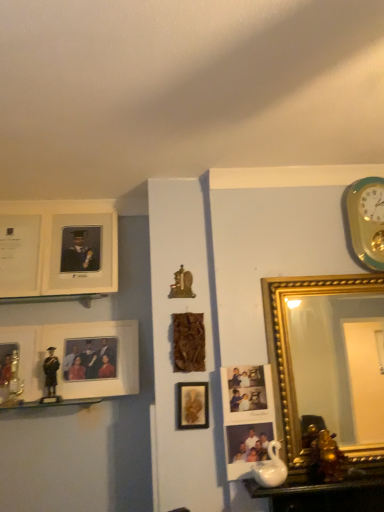
What do you see at coordinates (323, 495) in the screenshot? This screenshot has width=384, height=512. I see `white glossy table at lower right` at bounding box center [323, 495].

Measure the distance between point (3, 387) and camera.

A distance of 6.15 feet exists between point (3, 387) and camera.

In order to click on white glossy table at lower right in this screenshot , I will do pos(323,495).

From the image's perspective, between matte plastic photo frame at center, which is the eighth picture frame in left-to-right order, and wooden plaque at center, which is the fourth picture frame in right-to-left order, which one is located above?

wooden plaque at center, which is the fourth picture frame in right-to-left order, appears higher in the image.

Does point (250, 389) appear closer or farther from the camera than point (197, 337)?

Clearly, point (250, 389) is closer to the camera than point (197, 337).

In the scene shown: Is the depth of matte plastic photo frame at center, arranged as the 2th picture frame when viewed from the right, less than that of wooden plaque at center, which is the fourth picture frame in right-to-left order?

Yes, it is in front of wooden plaque at center, which is the fourth picture frame in right-to-left order.

Identify the location of picture frame that is the 2nd object to the right of the wooden plaque at center, which is the sixth picture frame in left-to-right order, starting at the anchor. This screenshot has height=512, width=384. (247, 417).

Is matte plastic photo frame at center, which is the eighth picture frame in left-to-right order, positioned far away from matte gold picture frame at center, placed as the seventh picture frame when sorted from left to right?

No, there isn't a large distance between matte plastic photo frame at center, which is the eighth picture frame in left-to-right order, and matte gold picture frame at center, placed as the seventh picture frame when sorted from left to right.

Does matte plastic photo frame at center, arranged as the 2th picture frame when viewed from the right, appear on the left side of matte gold picture frame at center, which appears as the 3th picture frame when viewed from the right?

No, matte plastic photo frame at center, arranged as the 2th picture frame when viewed from the right, is not to the left of matte gold picture frame at center, which appears as the 3th picture frame when viewed from the right.

Is matte plastic photo frame at center, arranged as the 2th picture frame when viewed from the right, oriented away from matte gold picture frame at center, which appears as the 3th picture frame when viewed from the right?

That's not correct — matte plastic photo frame at center, arranged as the 2th picture frame when viewed from the right, is not looking away from matte gold picture frame at center, which appears as the 3th picture frame when viewed from the right.

Measure the distance from matte plastic photo frame at center, arranged as the 2th picture frame when viewed from the right, to matte gold picture frame at center, which appears as the 3th picture frame when viewed from the right.

A distance of 6.56 inches exists between matte plastic photo frame at center, arranged as the 2th picture frame when viewed from the right, and matte gold picture frame at center, which appears as the 3th picture frame when viewed from the right.

Is matte plastic photo frame at center, which is the eighth picture frame in left-to-right order, facing away from matte white picture frame at upper left, the 6th picture frame in the right-to-left sequence?

No, matte plastic photo frame at center, which is the eighth picture frame in left-to-right order, is not facing away from matte white picture frame at upper left, the 6th picture frame in the right-to-left sequence.

Which point is more forward, [273,412] or [31,240]?

The point [273,412] is in front.

Looking at this image, considering the sizes of objects matte plastic photo frame at center, arranged as the 2th picture frame when viewed from the right, and matte white picture frame at upper left, which is the fourth picture frame in left-to-right order, in the image provided, who is thinner, matte plastic photo frame at center, arranged as the 2th picture frame when viewed from the right, or matte white picture frame at upper left, which is the fourth picture frame in left-to-right order,?

Thinner between the two is matte plastic photo frame at center, arranged as the 2th picture frame when viewed from the right.

Is matte plastic photo frame at center, which is the eighth picture frame in left-to-right order, in contact with matte white picture frame at upper left, the 6th picture frame in the right-to-left sequence?

No.

Who is taller, matte plastic photo frame at center, which is the eighth picture frame in left-to-right order, or gold/gilded mirror at right, the ninth picture frame positioned from the left?

gold/gilded mirror at right, the ninth picture frame positioned from the left.

Looking at this image, from the image's perspective, relative to gold/gilded mirror at right, the first picture frame in the right-to-left sequence, is matte plastic photo frame at center, arranged as the 2th picture frame when viewed from the right, above or below?

matte plastic photo frame at center, arranged as the 2th picture frame when viewed from the right, is below gold/gilded mirror at right, the first picture frame in the right-to-left sequence.

Who is smaller, matte plastic photo frame at center, arranged as the 2th picture frame when viewed from the right, or gold/gilded mirror at right, the ninth picture frame positioned from the left?

matte plastic photo frame at center, arranged as the 2th picture frame when viewed from the right, is smaller.

Considering the sizes of objects white glossy table at lower right and matte white picture frame at left, which ranks as the 5th picture frame in left-to-right order, in the image provided, who is smaller, white glossy table at lower right or matte white picture frame at left, which ranks as the 5th picture frame in left-to-right order,?

A: With smaller size is white glossy table at lower right.

Is white glossy table at lower right turned away from matte white picture frame at left, which ranks as the 5th picture frame in left-to-right order?

That's not correct — white glossy table at lower right is not looking away from matte white picture frame at left, which ranks as the 5th picture frame in left-to-right order.

From the image's perspective, is white glossy table at lower right above matte white picture frame at left, the 5th picture frame from the right?

Incorrect, from the image's perspective, white glossy table at lower right is lower than matte white picture frame at left, the 5th picture frame from the right.

Is white glossy table at lower right placed right next to matte white picture frame at left, which ranks as the 5th picture frame in left-to-right order?

No, white glossy table at lower right is not next to matte white picture frame at left, which ranks as the 5th picture frame in left-to-right order.

Considering the sizes of white glossy table at lower right and matte gold picture frame at center, placed as the seventh picture frame when sorted from left to right, in the image, is white glossy table at lower right wider or thinner than matte gold picture frame at center, placed as the seventh picture frame when sorted from left to right,?

Considering their sizes, white glossy table at lower right looks broader than matte gold picture frame at center, placed as the seventh picture frame when sorted from left to right.

How many degrees apart are the facing directions of white glossy table at lower right and matte gold picture frame at center, placed as the seventh picture frame when sorted from left to right?

The angle between the facing direction of white glossy table at lower right and the facing direction of matte gold picture frame at center, placed as the seventh picture frame when sorted from left to right, is 4.64 degrees.

Could you tell me if white glossy table at lower right is turned towards matte gold picture frame at center, placed as the seventh picture frame when sorted from left to right?

No.

Considering the positions of points (277, 508) and (207, 409), is point (277, 508) closer to camera compared to point (207, 409)?

That is True.

Considering their positions, is metallic gold picture frame at left, the second picture frame when ordered from left to right, located in front of or behind matte white picture frame at left, which ranks as the 5th picture frame in left-to-right order?

metallic gold picture frame at left, the second picture frame when ordered from left to right, is in front of matte white picture frame at left, which ranks as the 5th picture frame in left-to-right order.

Based on the photo, would you say metallic gold picture frame at left, the second picture frame when ordered from left to right, contains matte white picture frame at left, which ranks as the 5th picture frame in left-to-right order?

No.

Is metallic gold picture frame at left, the second picture frame when ordered from left to right, not near matte white picture frame at left, which ranks as the 5th picture frame in left-to-right order?

metallic gold picture frame at left, the second picture frame when ordered from left to right, is near matte white picture frame at left, which ranks as the 5th picture frame in left-to-right order, not far away.

Considering the relative sizes of metallic gold picture frame at left, which is the 8th picture frame from right to left, and matte white picture frame at left, the 5th picture frame from the right, in the image provided, is metallic gold picture frame at left, which is the 8th picture frame from right to left, thinner than matte white picture frame at left, the 5th picture frame from the right,?

Indeed, metallic gold picture frame at left, which is the 8th picture frame from right to left, has a lesser width compared to matte white picture frame at left, the 5th picture frame from the right.

From a real-world perspective, starting from the wooden plaque at center, which is the sixth picture frame in left-to-right order, which picture frame is the 6th one below it? Please provide its 2D coordinates.

[(247, 417)]

Find the location of a particular element. the 1st picture frame to the left of the matte plastic photo frame at center, which is the eighth picture frame in left-to-right order, counting from the anchor's position is located at coordinates (192, 405).

When comparing their distances from matte plastic photo frame at center, which is the eighth picture frame in left-to-right order, does teal-golden wall clock at upper right or metallic gold picture frame at left, the second picture frame when ordered from left to right, seem closer?

The object closer to matte plastic photo frame at center, which is the eighth picture frame in left-to-right order, is teal-golden wall clock at upper right.

From the image, which object appears to be nearer to matte white picture frame at upper left, the 6th picture frame in the right-to-left sequence, wooden plaque at center, which is the sixth picture frame in left-to-right order, or white matte picture frame at upper left, arranged as the ninth picture frame when viewed from the right?

Based on the image, white matte picture frame at upper left, arranged as the ninth picture frame when viewed from the right, appears to be nearer to matte white picture frame at upper left, the 6th picture frame in the right-to-left sequence.

Which object lies nearer to the anchor point teal-golden wall clock at upper right, white matte picture frame at upper left, the first picture frame positioned from the left, or gold/gilded mirror at right, the ninth picture frame positioned from the left?

gold/gilded mirror at right, the ninth picture frame positioned from the left, lies closer to teal-golden wall clock at upper right than the other object.

Looking at the image, which one is located closer to gold/gilded mirror at right, the ninth picture frame positioned from the left, matte gold picture frame at center, placed as the seventh picture frame when sorted from left to right, or metallic gold picture frame at left, the second picture frame when ordered from left to right?

Based on the image, matte gold picture frame at center, placed as the seventh picture frame when sorted from left to right, appears to be nearer to gold/gilded mirror at right, the ninth picture frame positioned from the left.

Considering their positions, is teal-golden wall clock at upper right positioned closer to matte white picture frame at left, the 5th picture frame from the right, than gold/gilded mirror at right, the ninth picture frame positioned from the left?

gold/gilded mirror at right, the ninth picture frame positioned from the left, is closer to matte white picture frame at left, the 5th picture frame from the right.

Looking at the image, which one is located closer to teal-golden wall clock at upper right, matte gold picture frame at center, which appears as the 3th picture frame when viewed from the right, or wooden plaque at center, which is the sixth picture frame in left-to-right order?

wooden plaque at center, which is the sixth picture frame in left-to-right order, lies closer to teal-golden wall clock at upper right than the other object.

Estimate the real-world distances between objects in this image. Which object is further from gold metallic picture frame at left, the seventh picture frame in the right-to-left sequence, white glossy table at lower right or matte gold picture frame at center, placed as the seventh picture frame when sorted from left to right?

white glossy table at lower right is positioned further to the anchor gold metallic picture frame at left, the seventh picture frame in the right-to-left sequence.

From the image, which object appears to be nearer to matte plastic photo frame at center, arranged as the 2th picture frame when viewed from the right, gold/gilded mirror at right, the first picture frame in the right-to-left sequence, or metallic gold picture frame at left, which is the 8th picture frame from right to left?

gold/gilded mirror at right, the first picture frame in the right-to-left sequence.

The width and height of the screenshot is (384, 512). In order to click on table between matte white picture frame at upper left, which is the fourth picture frame in left-to-right order, and teal-golden wall clock at upper right in this screenshot , I will do `click(323, 495)`.

Identify the location of picture frame between matte white picture frame at upper left, which is the fourth picture frame in left-to-right order, and wooden plaque at center, which is the fourth picture frame in right-to-left order, from left to right. (74, 361).

Locate an element on the screen. picture frame situated between matte gold picture frame at center, which appears as the 3th picture frame when viewed from the right, and white glossy table at lower right from left to right is located at coordinates (247, 417).

At what (x,y) coordinates should I click in order to perform the action: click on table located between metallic gold picture frame at left, which is the 8th picture frame from right to left, and teal-golden wall clock at upper right in the left-right direction. Please return your answer as a coordinate pair (x, y). The width and height of the screenshot is (384, 512). Looking at the image, I should click on (323, 495).